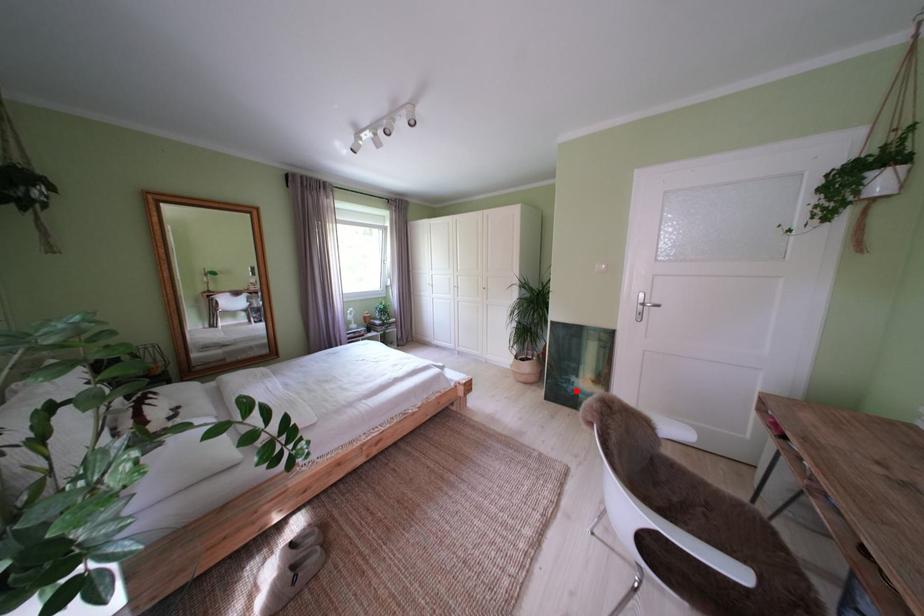
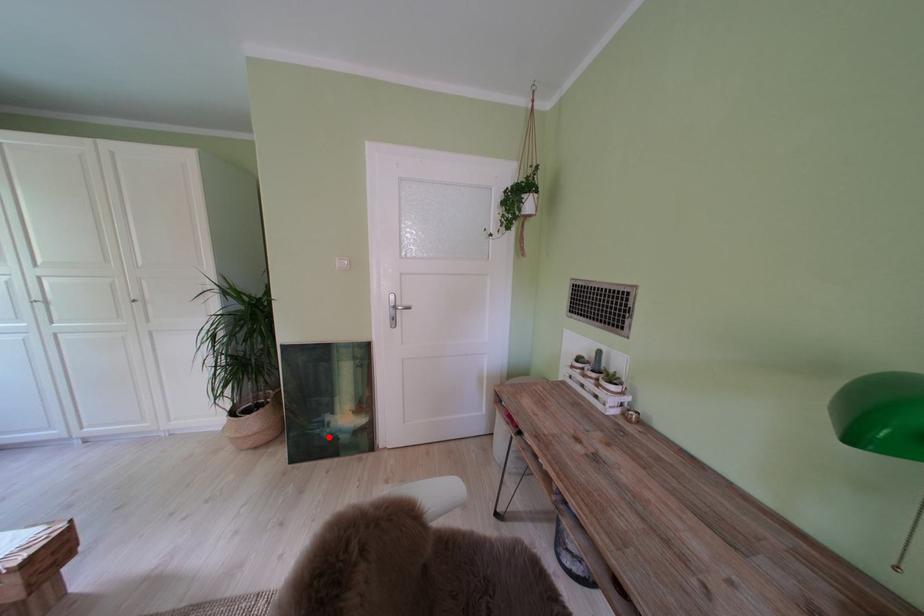
I am providing you with two images of the same scene from different viewpoints. A red point is marked on the first image and another point is marked on the second image. Does the point marked in image1 correspond to the same location as the one in image2?

Yes